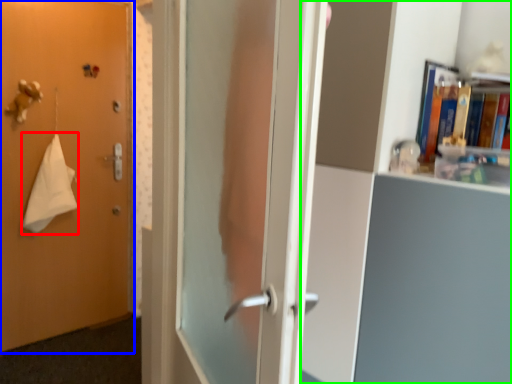
Question: Which is nearer to the bath towel (highlighted by a red box)? door (highlighted by a blue box) or bookcase (highlighted by a green box).

Choices:
 (A) door
 (B) bookcase

Answer: (A)